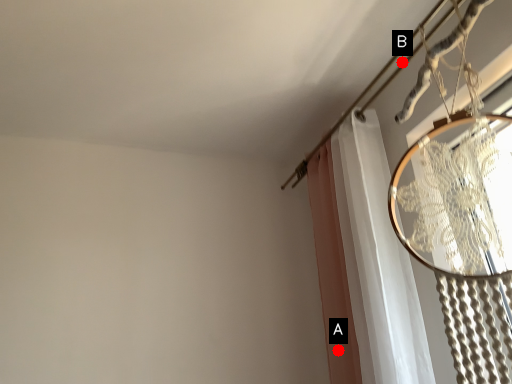
Question: Two points are circled on the image, labeled by A and B beside each circle. Which point is farther to the camera?

Choices:
 (A) A is further
 (B) B is further

Answer: (B)